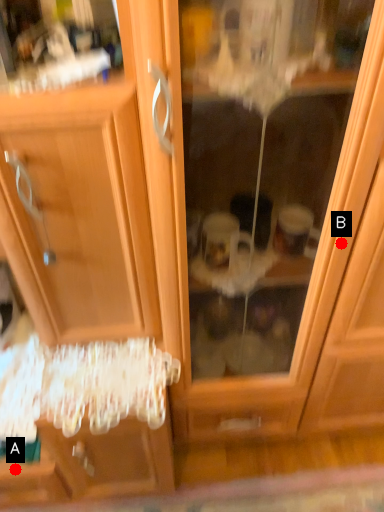
Question: Two points are circled on the image, labeled by A and B beside each circle. Which point is farther from the camera taking this photo?

Choices:
 (A) A is further
 (B) B is further

Answer: (A)